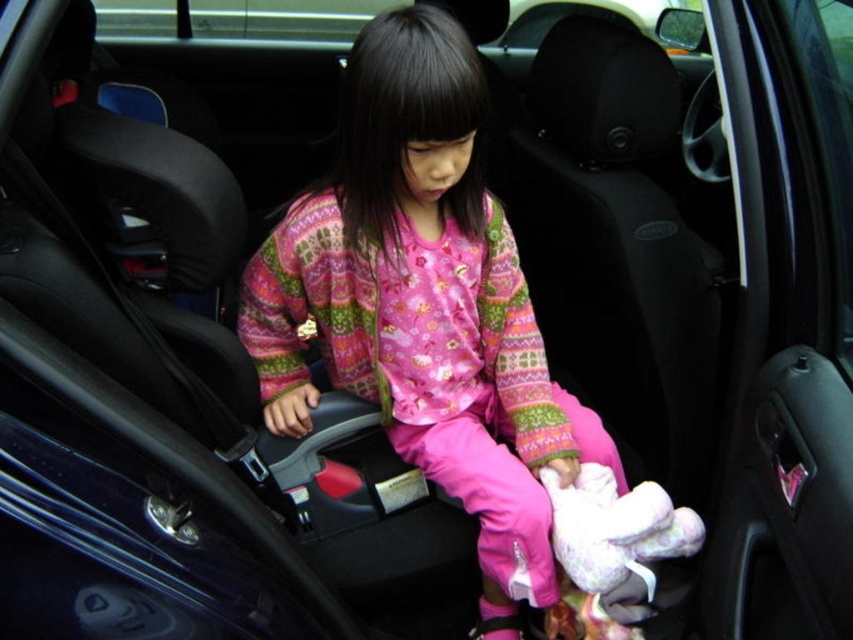
You are a photographer trying to capture the girl in the car. You notice the pink fabric pajamas at center and the white plush toy at center. Which item is covering part of the other?

The pink fabric pajamas at center is positioned over the white plush toy at center, so the pajamas are covering part of the toy.

Please describe the location of the pink fabric pajamas at center in the car seat using coordinates. The car seat has a coordinate system where the bottom left corner is the origin point. The x and y axes are measured in meters. The total width of the car seat is 1.2 meters and the height is 0.8 meters. The coordinate values are between 0 and 1. The answer should state the exact coordinates given in the description.

The pink fabric pajamas at center are located at coordinates point [424,305].